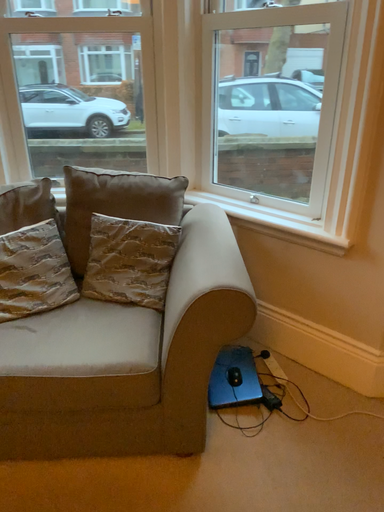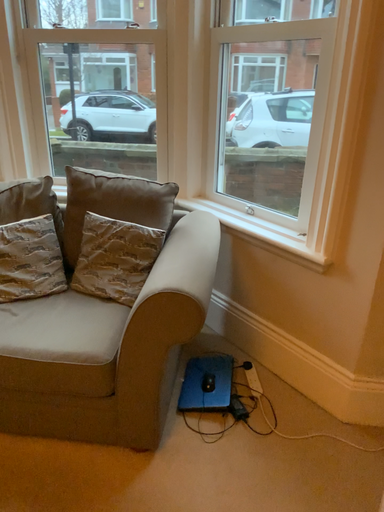
Question: Which way did the camera rotate in the video?

Choices:
 (A) rotated right
 (B) rotated left

Answer: (B)